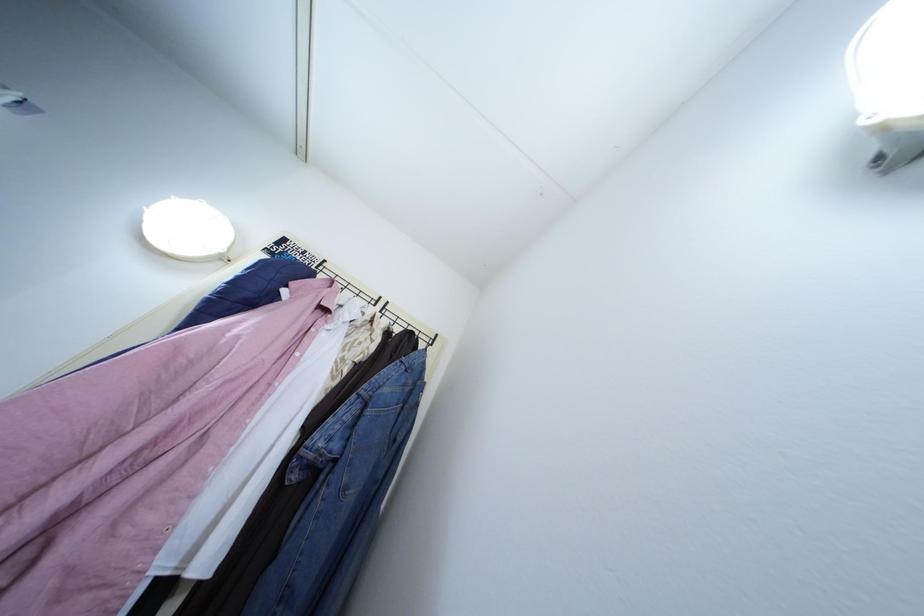
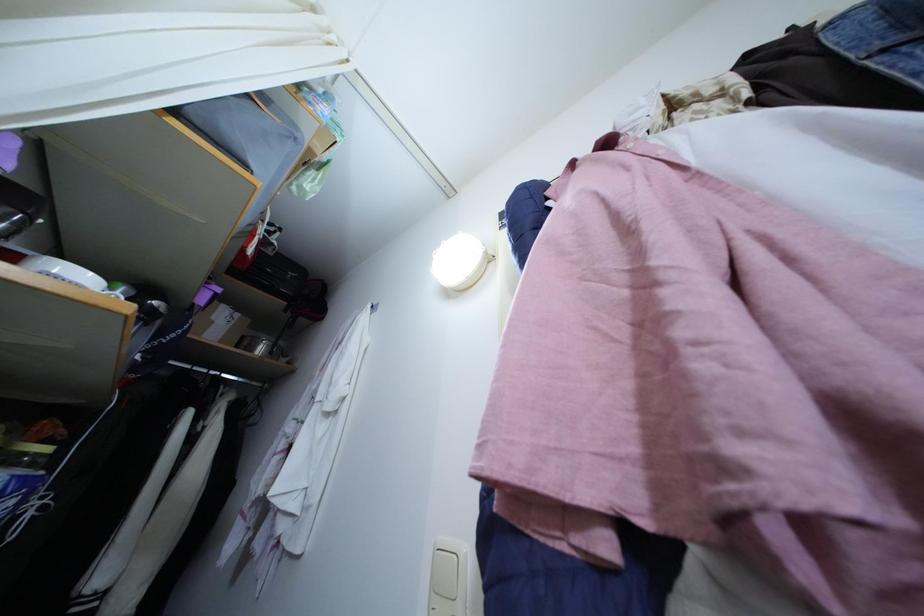
The images are taken continuously from a first-person perspective. In which direction is your viewpoint rotating?

The camera rotated toward left-up.